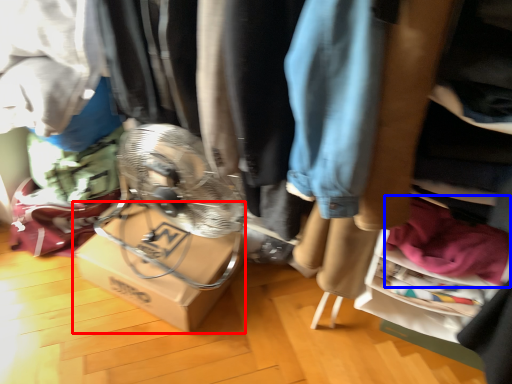
Question: Which object is further to the camera taking this photo, cardboard box (highlighted by a red box) or clothing (highlighted by a blue box)?

Choices:
 (A) cardboard box
 (B) clothing

Answer: (A)